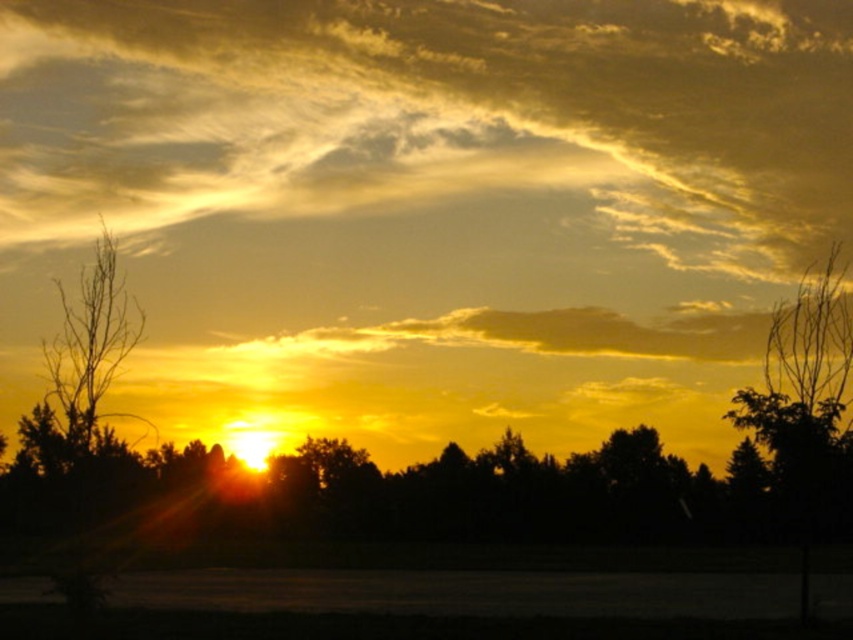
Does golden/yellow cloud at upper center have a larger size compared to bare branches at left?

Correct, golden/yellow cloud at upper center is larger in size than bare branches at left.

Is point (368, 116) positioned before point (115, 300)?

No, it is not.

Identify the location of golden/yellow cloud at upper center. (430, 163).